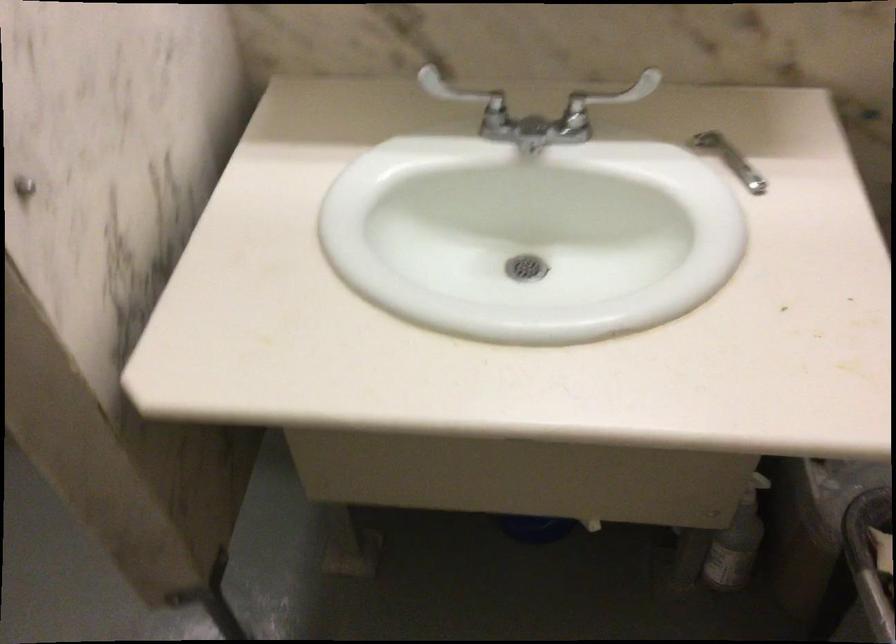
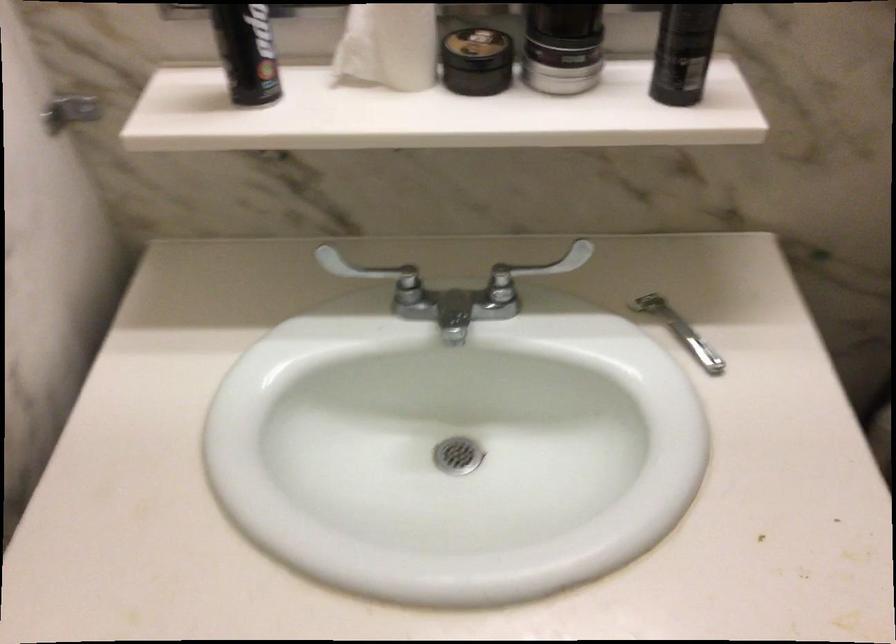
Where in the second image is the point corresponding to point 725,158 from the first image?

(679, 330)